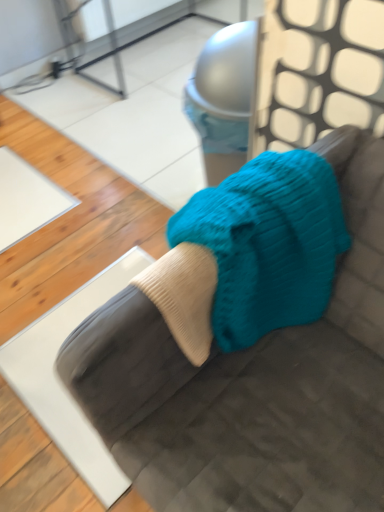
Identify the location of knitted teal sweater at upper right. The height and width of the screenshot is (512, 384). (253, 384).

Describe the element at coordinates (253, 384) in the screenshot. I see `knitted teal sweater at upper right` at that location.

Identify the location of knitted teal sweater at upper right. The height and width of the screenshot is (512, 384). (253, 384).